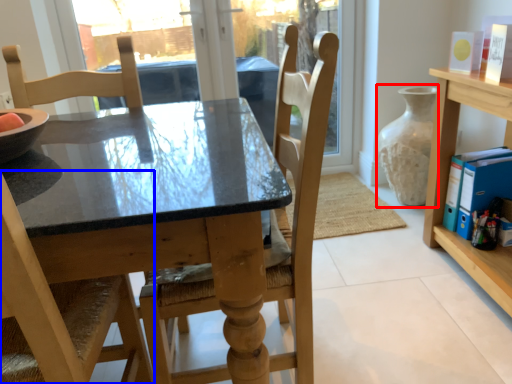
Question: Which point is closer to the camera, glass vase (highlighted by a red box) or chair (highlighted by a blue box)?

Choices:
 (A) glass vase
 (B) chair

Answer: (B)